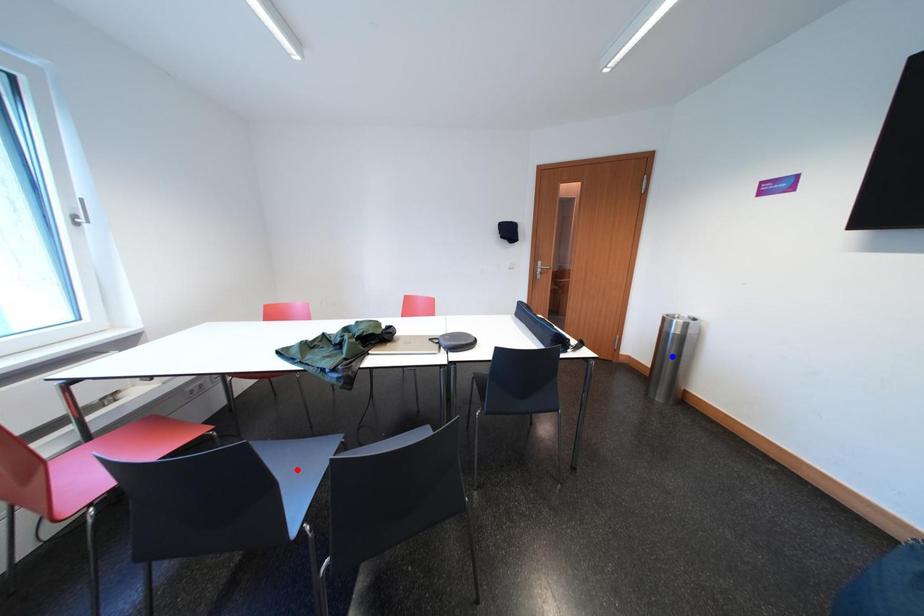
Question: In the image, two points are highlighted. Which point is nearer to the camera? Reply with the corresponding letter.

Choices:
 (A) blue point
 (B) red point

Answer: (B)